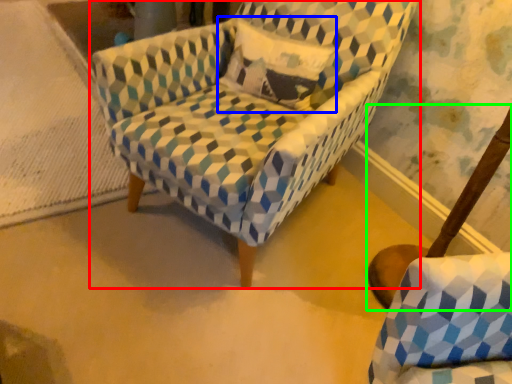
Question: Which is nearer to the chair (highlighted by a red box)? throw pillow (highlighted by a blue box) or swivel chair (highlighted by a green box).

Choices:
 (A) throw pillow
 (B) swivel chair

Answer: (A)